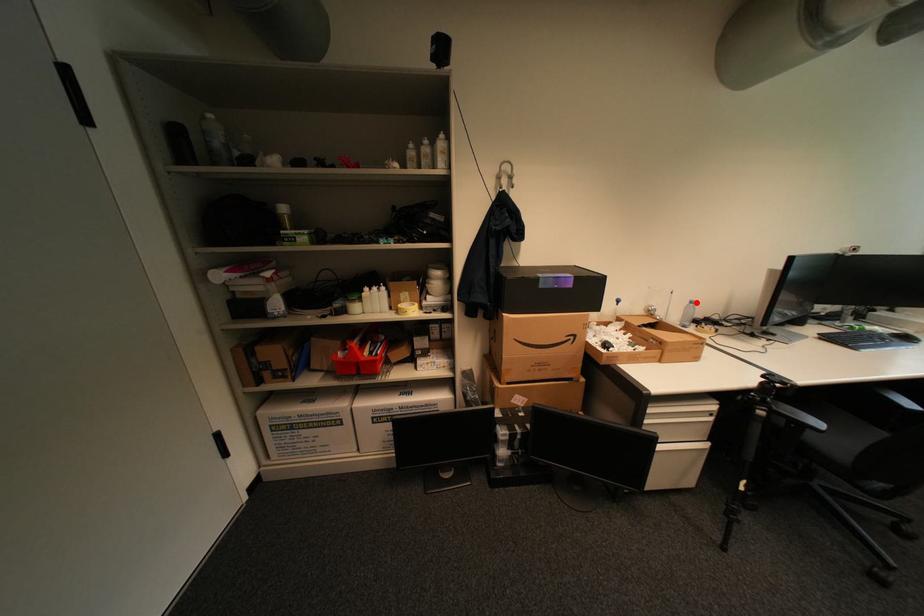
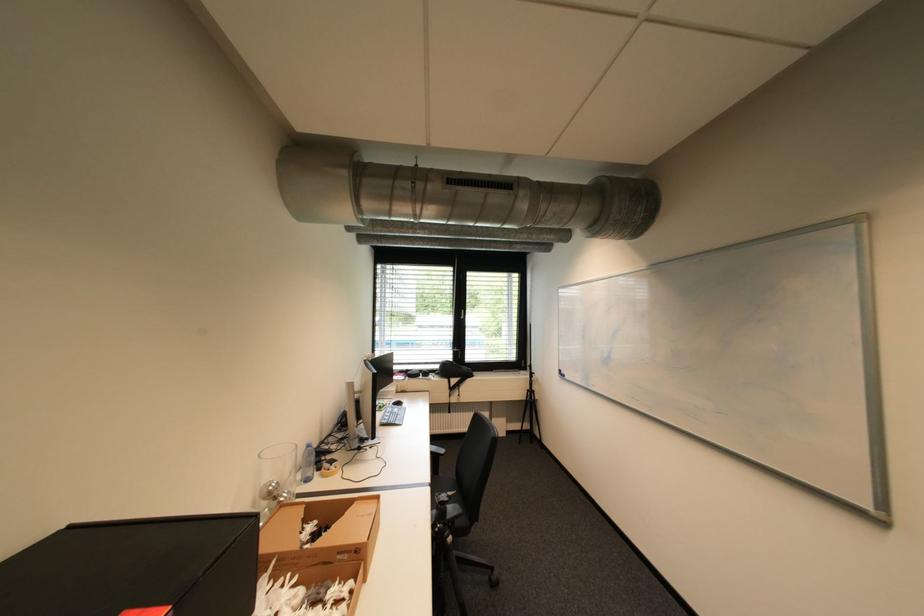
Question: I am providing you with two images of the same scene from different viewpoints. A red point is marked on the first image. Is the red point's position out of view in image 2?

Choices:
 (A) Yes
 (B) No

Answer: (B)